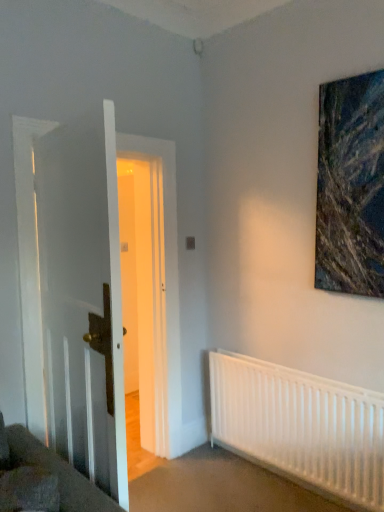
Question: Is textured canvas painting at upper right bigger or smaller than white matte radiator at lower right?

Choices:
 (A) big
 (B) small

Answer: (B)

Question: Looking at their shapes, would you say textured canvas painting at upper right is wider or thinner than white matte radiator at lower right?

Choices:
 (A) thin
 (B) wide

Answer: (A)

Question: Estimate the real-world distances between objects in this image. Which object is farther from the textured canvas painting at upper right?

Choices:
 (A) white wooden door at left
 (B) white matte radiator at lower right

Answer: (A)

Question: Considering the real-world distances, which object is farthest from the white matte radiator at lower right?

Choices:
 (A) textured canvas painting at upper right
 (B) white wooden door at left

Answer: (B)